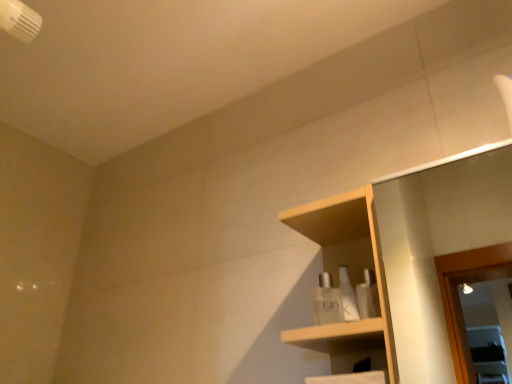
Question: From the image's perspective, is clear glass perfume at center, which appears as the second toiletry when viewed from the front, located above or below wooden shelf at center?

Choices:
 (A) above
 (B) below

Answer: (B)

Question: Visually, is clear glass perfume at center, which appears as the second toiletry when viewed from the front, positioned to the left or to the right of wooden shelf at center?

Choices:
 (A) right
 (B) left

Answer: (B)

Question: Considering the real-world distances, which object is farthest from the wooden shelf at center?

Choices:
 (A) white glossy bottles at center, which ranks as the 2th toiletry in back-to-front order
 (B) clear glass perfume at center, which appears as the second toiletry when viewed from the front

Answer: (B)

Question: Which is nearer to the white glossy bottles at center, acting as the first toiletry starting from the front?

Choices:
 (A) clear glass perfume at center, which appears as the second toiletry when viewed from the front
 (B) wooden shelf at center

Answer: (A)